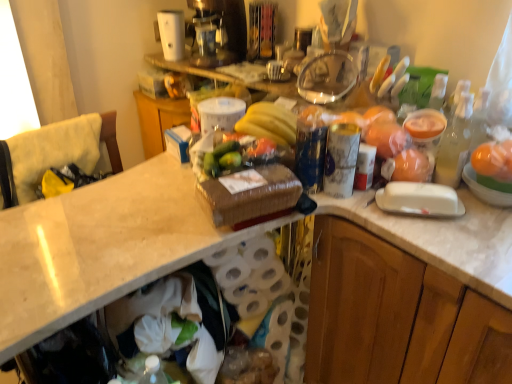
Question: Is yellow fabric cushion at left surrounded by translucent glass bottle at right?

Choices:
 (A) no
 (B) yes

Answer: (A)

Question: Can you confirm if translucent glass bottle at right is wider than yellow fabric cushion at left?

Choices:
 (A) yes
 (B) no

Answer: (B)

Question: Can you see translucent glass bottle at right touching yellow fabric cushion at left?

Choices:
 (A) yes
 (B) no

Answer: (B)

Question: Considering the relative sizes of translucent glass bottle at right and yellow fabric cushion at left in the image provided, is translucent glass bottle at right smaller than yellow fabric cushion at left?

Choices:
 (A) yes
 (B) no

Answer: (A)

Question: Does translucent glass bottle at right appear on the left side of yellow fabric cushion at left?

Choices:
 (A) yes
 (B) no

Answer: (B)

Question: Can you confirm if translucent glass bottle at right is thinner than yellow fabric cushion at left?

Choices:
 (A) no
 (B) yes

Answer: (B)

Question: Does yellow fabric cushion at left have a smaller size compared to translucent glass bottle at right?

Choices:
 (A) yes
 (B) no

Answer: (B)

Question: Is yellow fabric cushion at left positioned with its back to translucent glass bottle at right?

Choices:
 (A) yes
 (B) no

Answer: (B)

Question: From the image's perspective, would you say yellow fabric cushion at left is positioned over translucent glass bottle at right?

Choices:
 (A) no
 (B) yes

Answer: (A)

Question: From a real-world perspective, is yellow fabric cushion at left physically above translucent glass bottle at right?

Choices:
 (A) yes
 (B) no

Answer: (B)

Question: Does yellow fabric cushion at left come in front of translucent glass bottle at right?

Choices:
 (A) no
 (B) yes

Answer: (A)

Question: From the image's perspective, would you say yellow fabric cushion at left is shown under translucent glass bottle at right?

Choices:
 (A) no
 (B) yes

Answer: (B)

Question: Is translucent glass bottle at right not near orange matte plastic oranges at upper right?

Choices:
 (A) no
 (B) yes

Answer: (A)